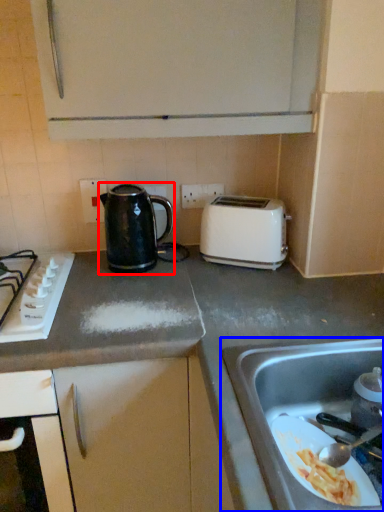
Question: Among these objects, which one is farthest to the camera, kettle (highlighted by a red box) or sink (highlighted by a blue box)?

Choices:
 (A) kettle
 (B) sink

Answer: (A)